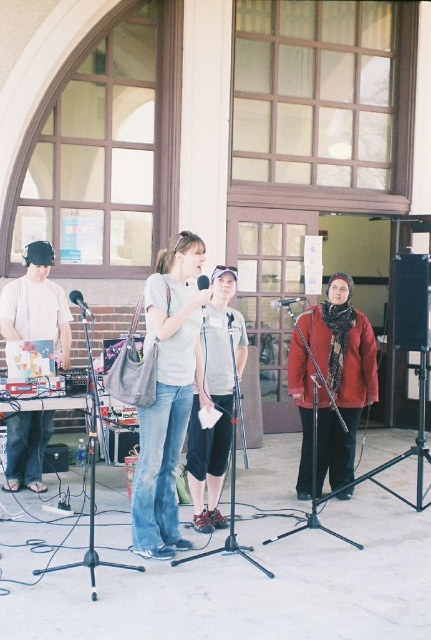
From the picture: Does matte white headphones at left have a larger size compared to metallic silver microphone at center?

Yes.

In the scene shown: Can you confirm if matte white headphones at left is positioned to the left of metallic silver microphone at center?

Correct, you'll find matte white headphones at left to the left of metallic silver microphone at center.

Between point (25, 314) and point (297, 301), which one is positioned in front?

Point (25, 314) is more forward.

This screenshot has width=431, height=640. What are the coordinates of `matte white headphones at left` in the screenshot? It's located at (37, 305).

Is matte gray shirt at center in front of metallic silver microphone at center?

Yes.

You are a GUI agent. You are given a task and a screenshot of the screen. Output one action in this format:
    pyautogui.click(x=<x>, y=<y>)
    Task: Click on the matte gray shirt at center
    Image resolution: width=431 pixels, height=640 pixels.
    Given the screenshot: What is the action you would take?
    pyautogui.click(x=215, y=403)

Based on the photo, which is more to the right, red woolen scarf at center or matte gray shirt at center?

Positioned to the right is red woolen scarf at center.

Who is shorter, red woolen scarf at center or matte gray shirt at center?

red woolen scarf at center is shorter.

Between point (355, 417) and point (194, 481), which one is positioned in front?

Point (194, 481) is more forward.

This screenshot has height=640, width=431. I want to click on red woolen scarf at center, so click(340, 376).